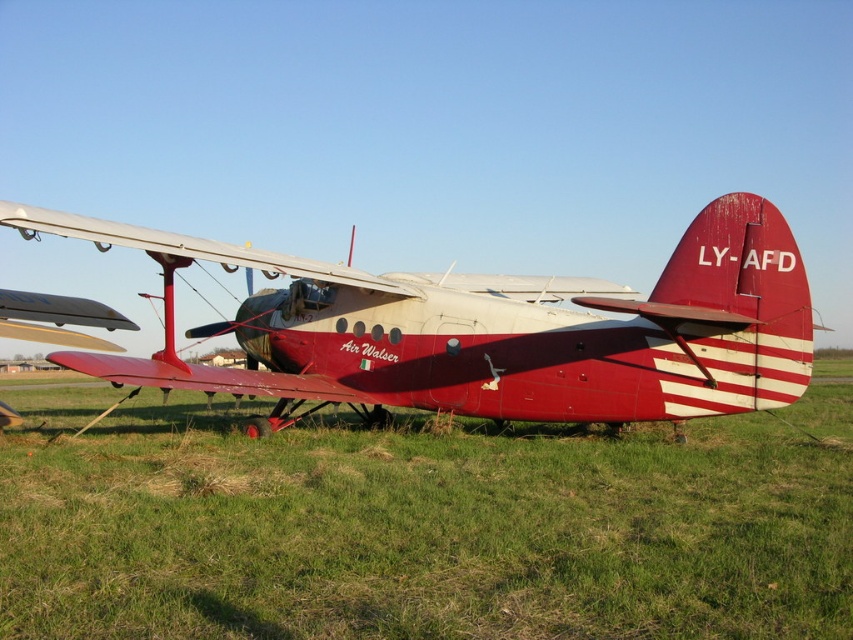
Is point (819, 579) positioned before point (379, 340)?

Yes, it is in front of point (379, 340).

Who is positioned more to the left, green grass at lower center or matte red airplane at center?

matte red airplane at center is more to the left.

Is point (798, 518) closer to camera compared to point (546, 390)?

Yes, it is.

The width and height of the screenshot is (853, 640). In order to click on green grass at lower center in this screenshot , I will do `click(421, 524)`.